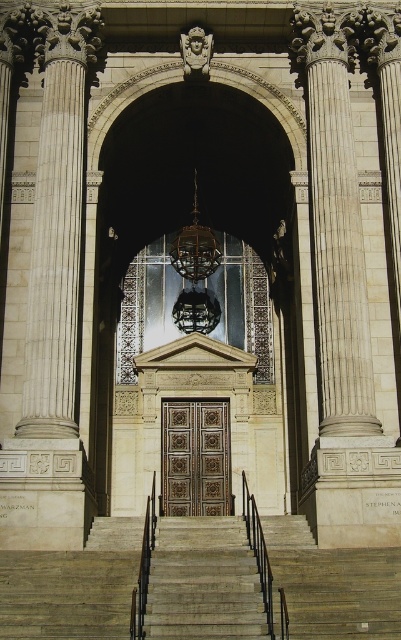
Question: Among these objects, which one is farthest from the camera?

Choices:
 (A) black metal railing at center
 (B) gold ornate door at center

Answer: (B)

Question: Which point is closer to the camera?

Choices:
 (A) tap(251, 536)
 (B) tap(164, 497)
 (C) tap(72, 600)

Answer: (C)

Question: Which is farther from the black metal railing at center?

Choices:
 (A) gray stone stairs at center
 (B) white marble column at left
 (C) gold ornate door at center

Answer: (B)

Question: Is gray stone stairs at center positioned in front of white marble column at left?

Choices:
 (A) no
 (B) yes

Answer: (B)

Question: Does white marble column at left appear over gold ornate door at center?

Choices:
 (A) yes
 (B) no

Answer: (A)

Question: Does white marble column at left come behind gold ornate door at center?

Choices:
 (A) no
 (B) yes

Answer: (A)